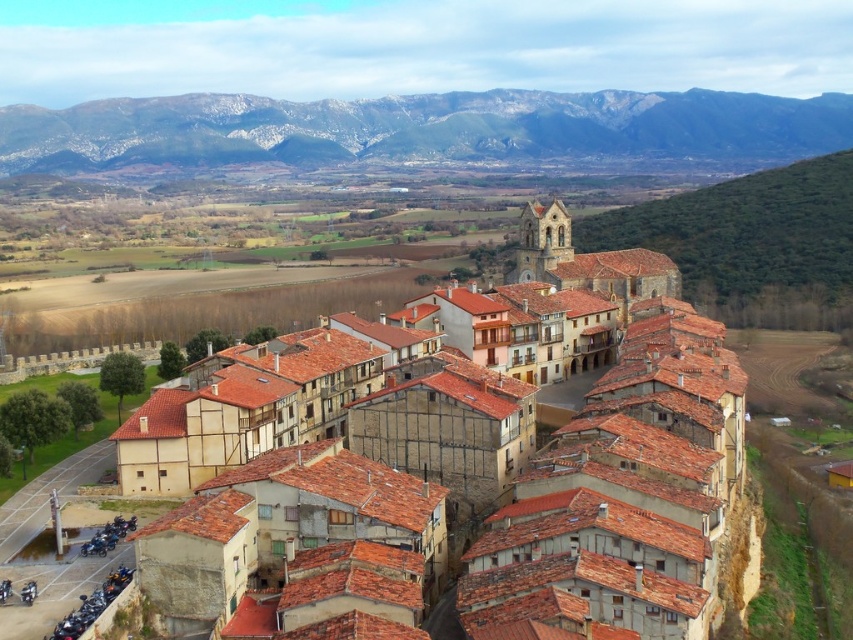
Is point (461, 483) behind point (218, 166)?

No, it is in front of (218, 166).

Where is `brown clay roof tiles at center`? brown clay roof tiles at center is located at coordinates (485, 492).

Which is in front, point (364, 486) or point (561, 125)?

Positioned in front is point (364, 486).

This screenshot has height=640, width=853. I want to click on brown clay roof tiles at center, so click(x=485, y=492).